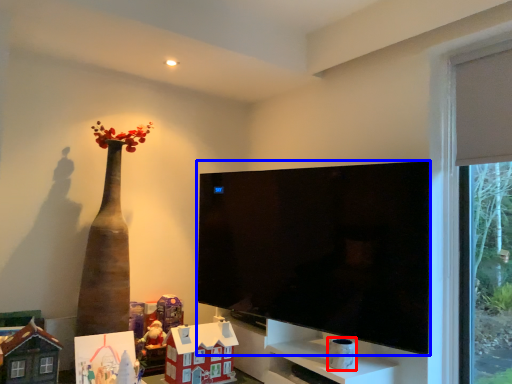
Question: Among these objects, which one is nearest to the camera, toy (highlighted by a red box) or television (highlighted by a blue box)?

Choices:
 (A) toy
 (B) television

Answer: (B)